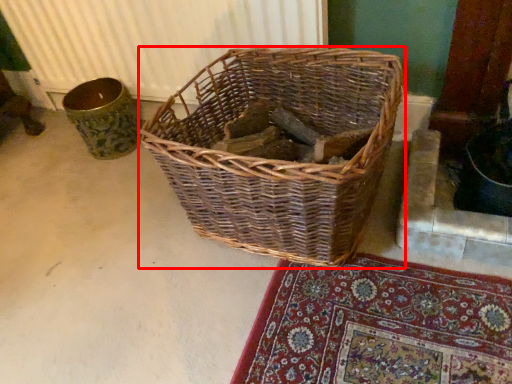
Question: From the image's perspective, where is picnic basket (annotated by the red box) located in relation to radiator in the image?

Choices:
 (A) below
 (B) above

Answer: (A)